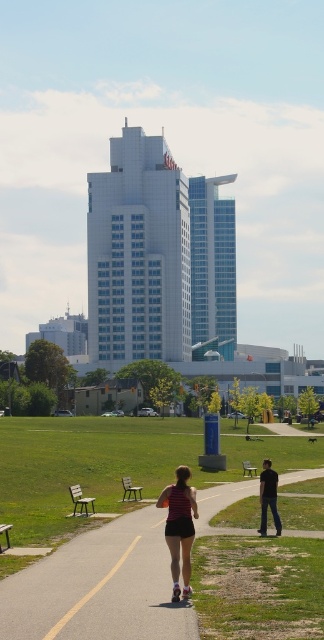
You are a photographer setting up a tripod in the park. You need to place it between the black smooth pants at lower right and the green wooden bench at lower left. Which object should you position the tripod closer to to ensure it doesn

The black smooth pants at lower right is wider than the green wooden bench at lower left, so positioning the tripod closer to the green wooden bench at lower left would provide more space between the two objects.

You are a photographer positioned at the edge of the park pathway. You want to capture a photo of the green plastic bench at lower center without the black smooth pants at lower right blocking the view. Based on their positions, is this possible?

The black smooth pants at lower right is in front of the green plastic bench at lower center, so it will block the view. To capture the bench without obstruction, you need to reposition yourself so that the pants are no longer between you and the bench.